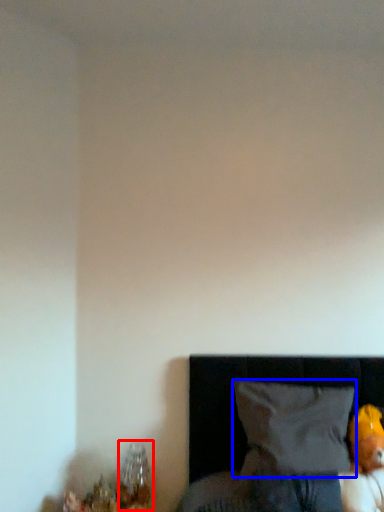
Question: Among these objects, which one is nearest to the camera, table lamp (highlighted by a red box) or pillow (highlighted by a blue box)?

Choices:
 (A) table lamp
 (B) pillow

Answer: (B)